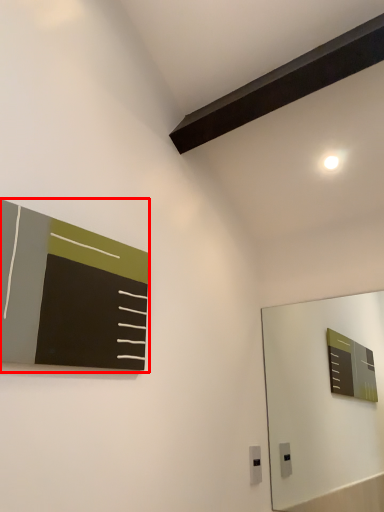
Question: From the image's perspective, considering the relative positions of bulletin board (annotated by the red box) and electric outlet in the image provided, where is bulletin board (annotated by the red box) located with respect to the staircase?

Choices:
 (A) below
 (B) above

Answer: (B)